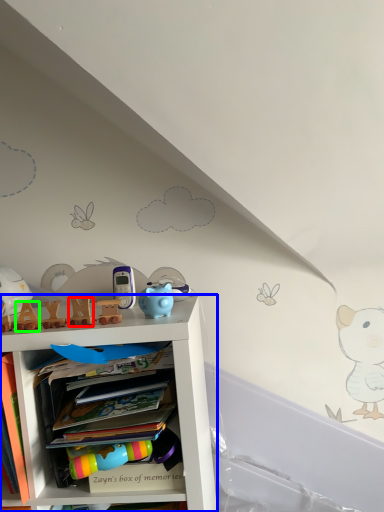
Question: Estimate the real-world distances between objects in this image. Which object is closer to toy (highlighted by a red box), shelf (highlighted by a blue box) or toy (highlighted by a green box)?

Choices:
 (A) shelf
 (B) toy

Answer: (B)